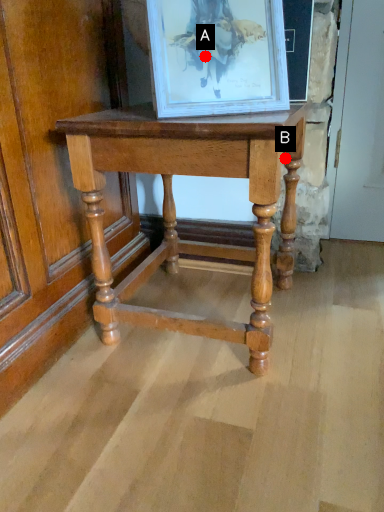
Question: Two points are circled on the image, labeled by A and B beside each circle. Which point is further to the camera?

Choices:
 (A) A is further
 (B) B is further

Answer: (B)